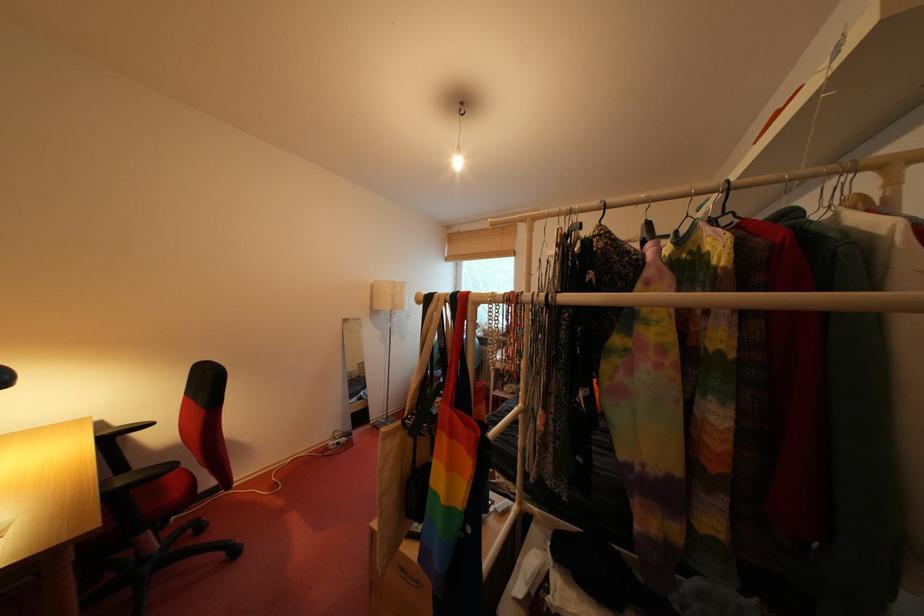
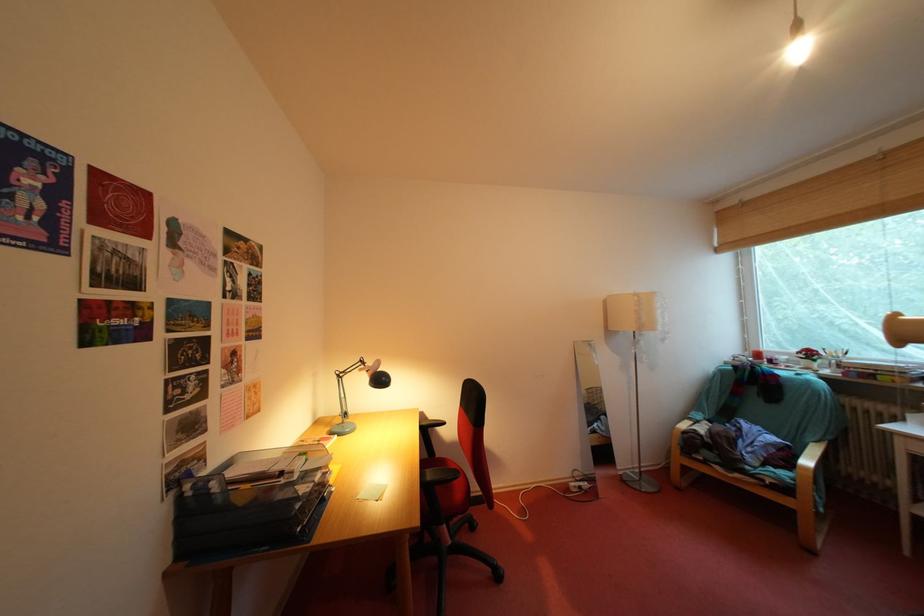
Question: The camera is either moving clockwise (left) or counter-clockwise (right) around the object. The first image is from the beginning of the video and the second image is from the end. Is the camera moving left or right when shooting the video?

Choices:
 (A) Left
 (B) Right

Answer: (B)